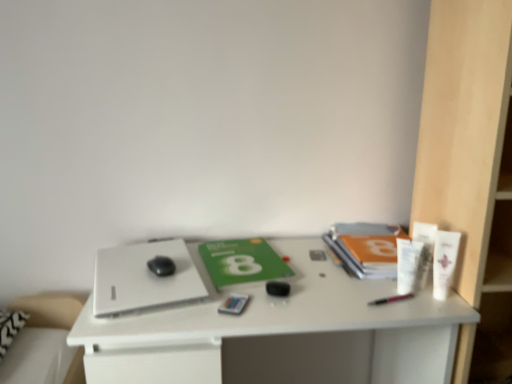
The image size is (512, 384). In order to click on vacant space to the right of black matte mouse at center in this screenshot , I will do `click(186, 273)`.